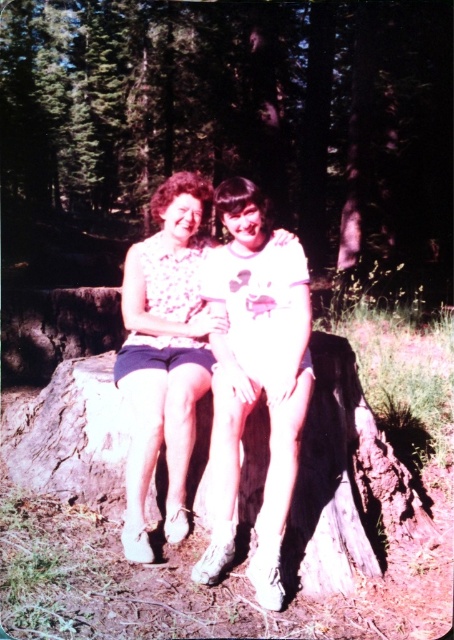
You are a photographer trying to capture a candid shot of the two people sitting on the brown rough tree stump at center and wearing the floral fabric dress at center. To ensure both subjects are in frame, should you adjust your camera to focus more on the left or the right side?

The brown rough tree stump at center is to the left of the floral fabric dress at center, so you should focus more on the left side to include both subjects in the frame.

Looking at this image, you are standing in the forest and see two people sitting on a tree stump. They are wearing a floral fabric dress at center and a floral fabric blouse at center. Which one is positioned to the right?

The floral fabric dress at center is positioned to the right of the floral fabric blouse at center.